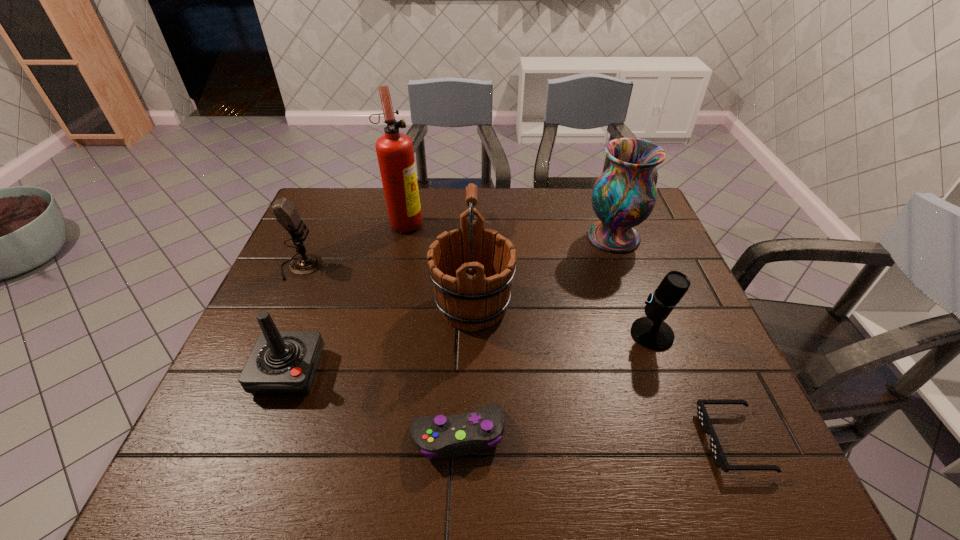
Locate an element on the screen. The height and width of the screenshot is (540, 960). fire extinguisher is located at coordinates (395, 154).

The height and width of the screenshot is (540, 960). In order to click on wine bucket in this screenshot , I will do `click(472, 269)`.

Where is `vase`? The height and width of the screenshot is (540, 960). vase is located at coordinates (624, 195).

Where is `the farther microphone`? This screenshot has width=960, height=540. the farther microphone is located at coordinates (286, 214).

Find the location of a particular element. The height and width of the screenshot is (540, 960). the right microphone is located at coordinates (651, 332).

Locate an element on the screen. The width and height of the screenshot is (960, 540). joystick is located at coordinates (282, 363).

Where is `the second shortest object`? the second shortest object is located at coordinates (468, 433).

The image size is (960, 540). I want to click on sunglasses, so click(x=716, y=450).

Identify the location of vacant space located 0.160m on the front-facing side of the fire extinguisher. The height and width of the screenshot is (540, 960). (473, 222).

Find the location of a particular element. This screenshot has height=540, width=960. vacant point located on the left of the wine bucket is located at coordinates point(359,305).